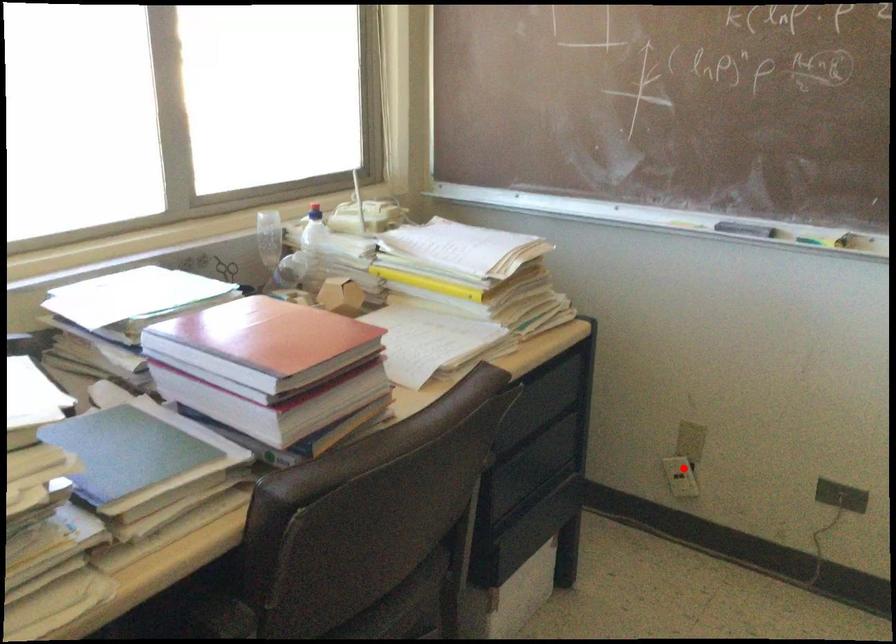
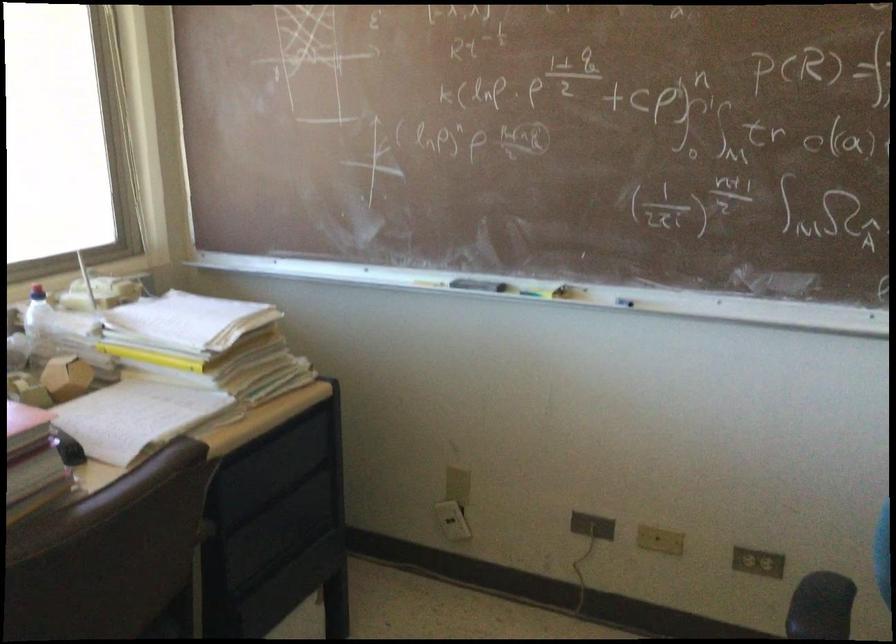
Where in the second image is the point corresponding to the highlighted location from the first image?

(452, 520)